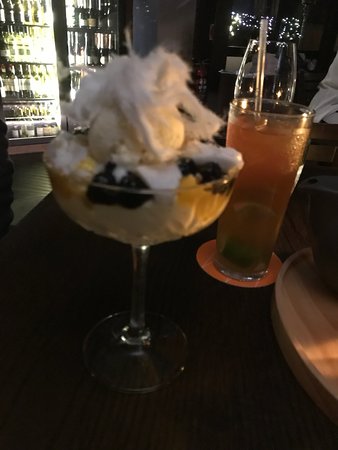
Identify the location of brown floor. (32, 183).